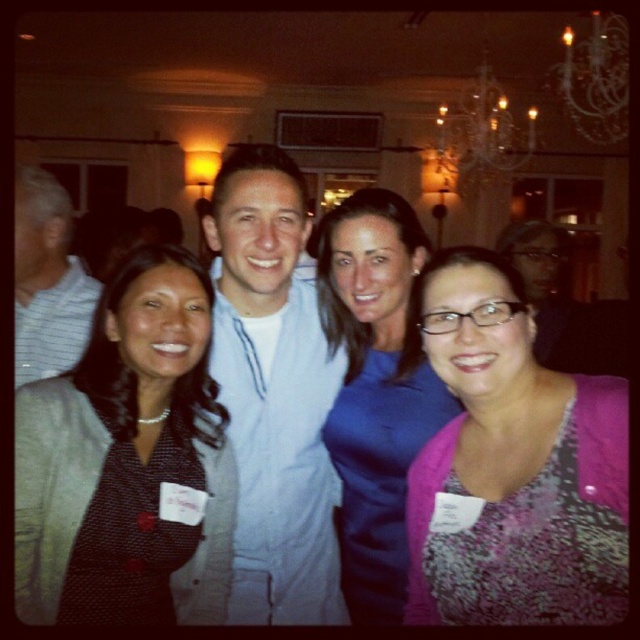
Which is above, pink textured sweater at lower right or matte light blue shirt at center?

Positioned higher is matte light blue shirt at center.

Who is more forward, (x=602, y=544) or (x=33, y=276)?

Point (x=602, y=544)

At what (x,y) coordinates should I click in order to perform the action: click on pink textured sweater at lower right. Please return your answer as a coordinate pair (x, y). Looking at the image, I should click on (515, 467).

Does light blue shirt at center have a smaller size compared to matte light blue shirt at center?

No.

The width and height of the screenshot is (640, 640). Find the location of `light blue shirt at center`. light blue shirt at center is located at coordinates (275, 394).

This screenshot has width=640, height=640. What do you see at coordinates (128, 461) in the screenshot?
I see `matte black dress at center` at bounding box center [128, 461].

Is matte black dress at center closer to the viewer compared to blue satin dress at center?

Yes.

Where is `matte black dress at center`? The height and width of the screenshot is (640, 640). matte black dress at center is located at coordinates (128, 461).